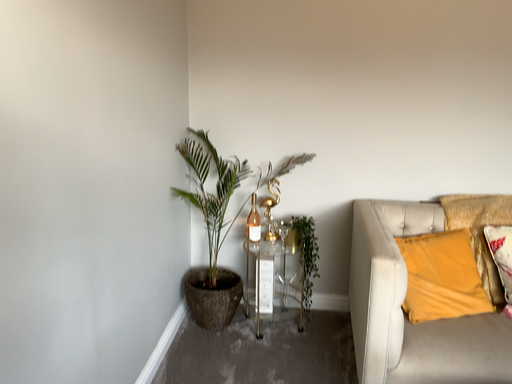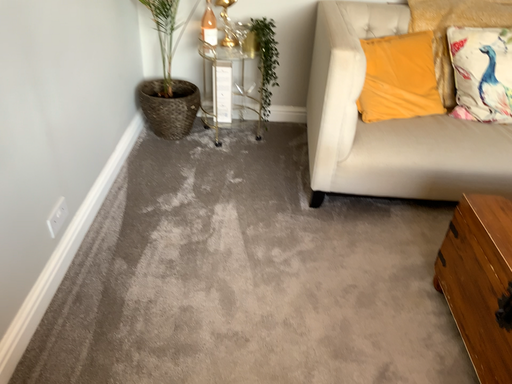
Question: Which way did the camera rotate in the video?

Choices:
 (A) rotated upward
 (B) rotated downward

Answer: (B)